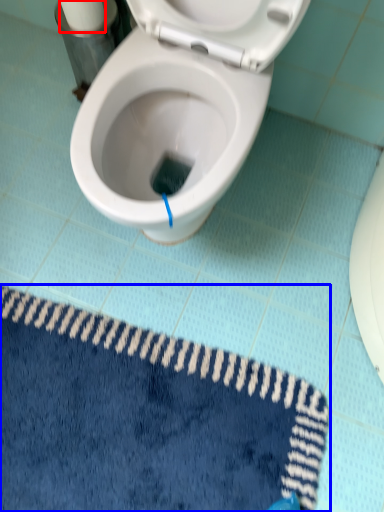
Question: Which of the following is the closest to the observer, toilet paper (highlighted by a red box) or bath mat (highlighted by a blue box)?

Choices:
 (A) toilet paper
 (B) bath mat

Answer: (B)